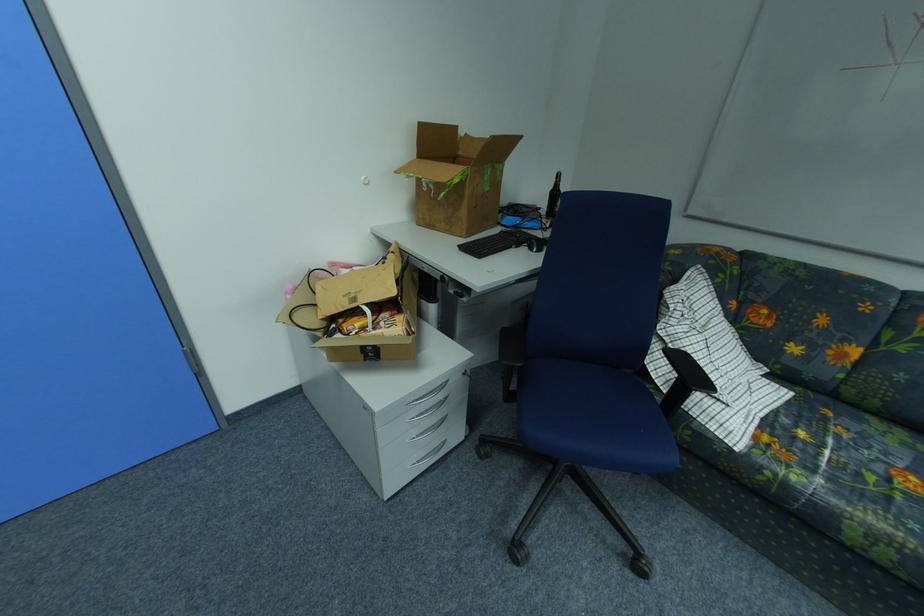
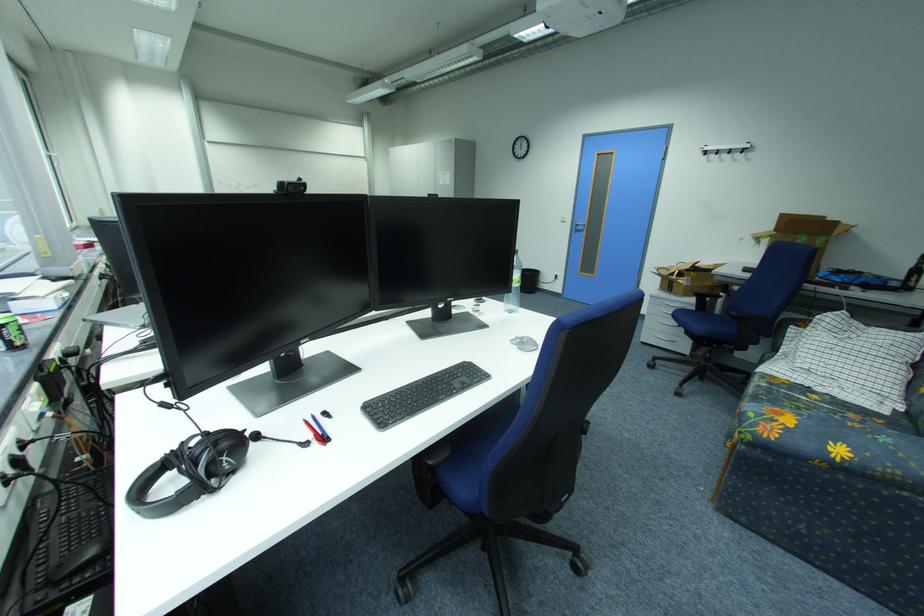
Locate, in the second image, the point that corresponds to [840,442] in the first image.

(834, 407)